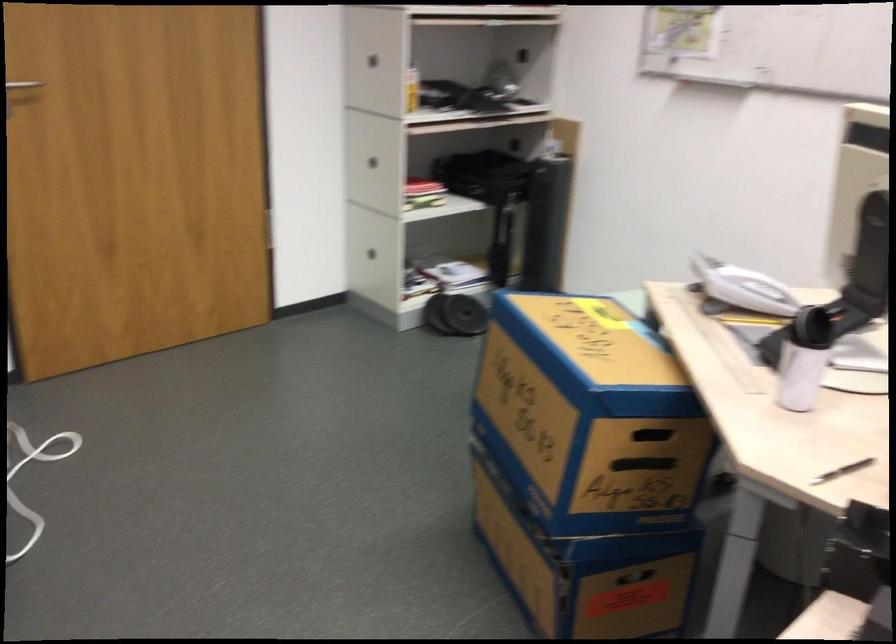
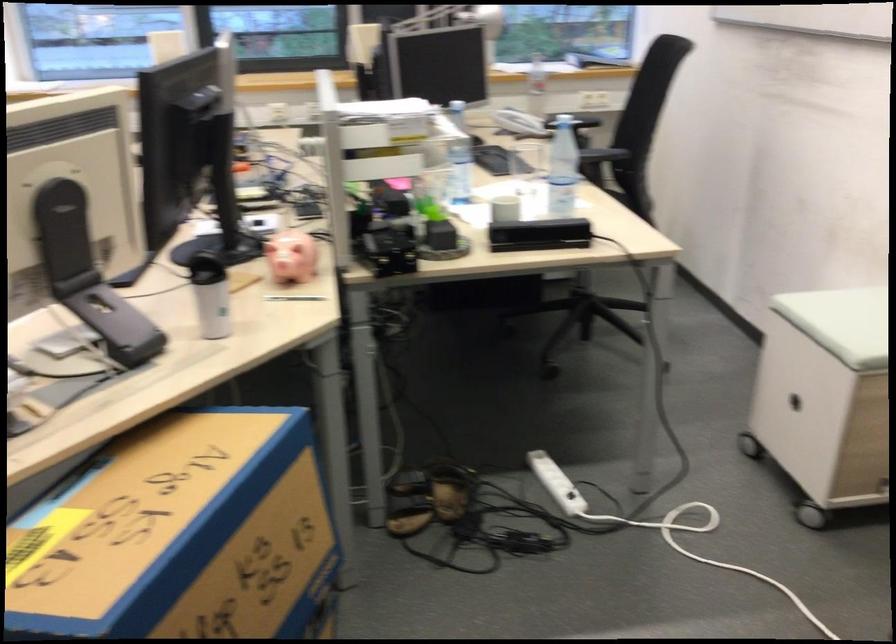
In the second image, find the point that corresponds to point (800, 355) in the first image.

(211, 295)